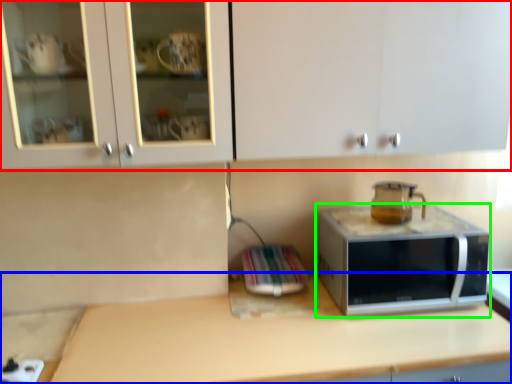
Question: Which is nearer to the cabinetry (highlighted by a red box)? countertop (highlighted by a blue box) or microwave oven (highlighted by a green box).

Choices:
 (A) countertop
 (B) microwave oven

Answer: (B)